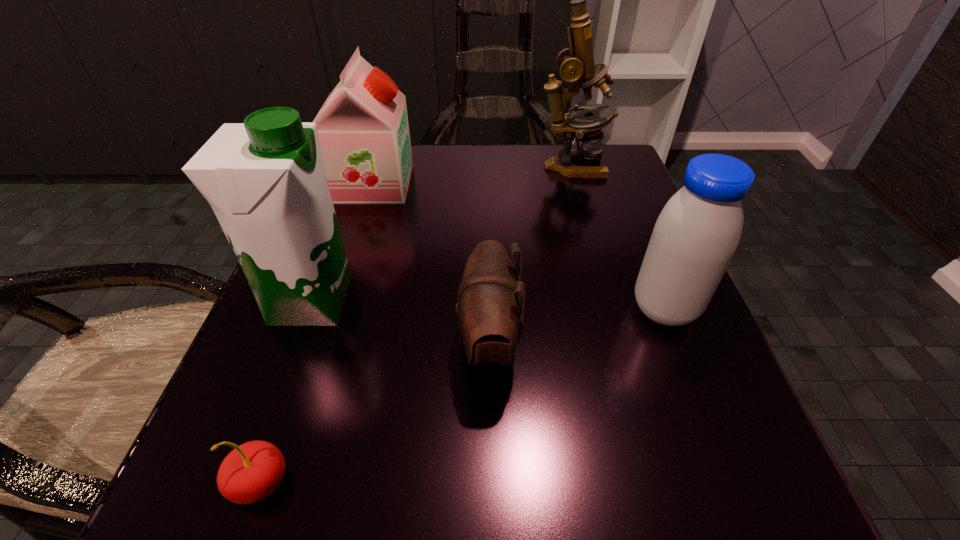
Locate an element on the screen. This screenshot has width=960, height=540. microscope is located at coordinates (576, 64).

Locate an element on the screen. The height and width of the screenshot is (540, 960). the tallest soya milk is located at coordinates [265, 180].

Where is `the farthest soya milk`? This screenshot has width=960, height=540. the farthest soya milk is located at coordinates (363, 130).

I want to click on the rightmost soya milk, so click(x=698, y=231).

Where is `pouch`? Image resolution: width=960 pixels, height=540 pixels. pouch is located at coordinates (491, 296).

The width and height of the screenshot is (960, 540). What are the coordinates of `the fifth tallest object` in the screenshot? It's located at (491, 296).

This screenshot has width=960, height=540. In order to click on the shortest object in this screenshot , I will do pos(251,472).

The width and height of the screenshot is (960, 540). I want to click on the nearest object, so click(251, 472).

This screenshot has height=540, width=960. I want to click on vacant space located on the front of the microscope, so click(x=611, y=302).

The image size is (960, 540). In order to click on free location located 0.360m on the front-facing side of the tallest soya milk in this screenshot , I will do `click(586, 301)`.